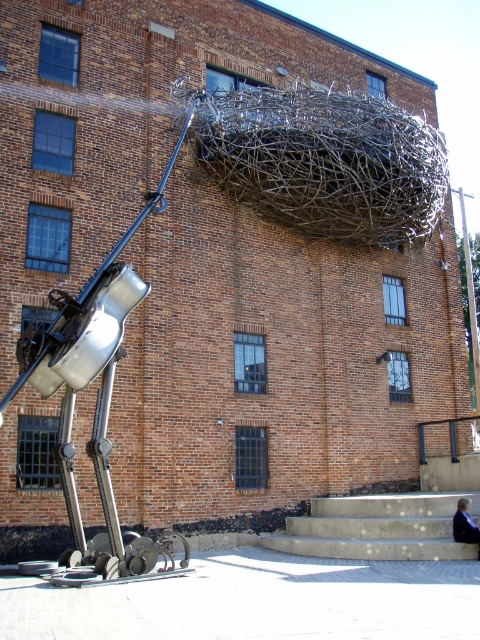
Does concrete stairs at lower right have a greater width compared to dark blue fabric jacket at lower right?

Correct, the width of concrete stairs at lower right exceeds that of dark blue fabric jacket at lower right.

Is point (377, 550) farther from viewer compared to point (471, 518)?

No.

Locate an element on the screen. The height and width of the screenshot is (640, 480). concrete stairs at lower right is located at coordinates (387, 518).